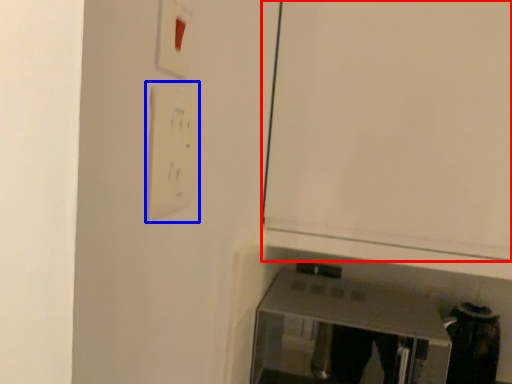
Question: Which object appears farthest to the camera in this image, door (highlighted by a red box) or light switch (highlighted by a blue box)?

Choices:
 (A) door
 (B) light switch

Answer: (A)